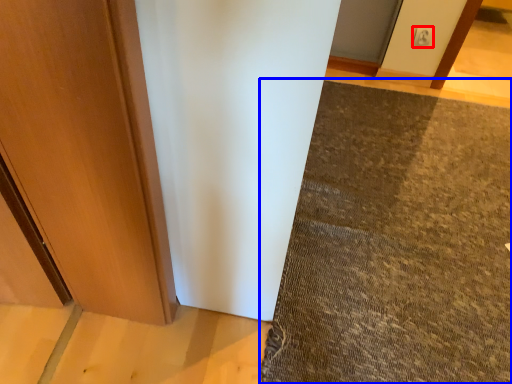
Question: Which object is closer to the camera taking this photo, electric outlet (highlighted by a red box) or mat (highlighted by a blue box)?

Choices:
 (A) electric outlet
 (B) mat

Answer: (B)